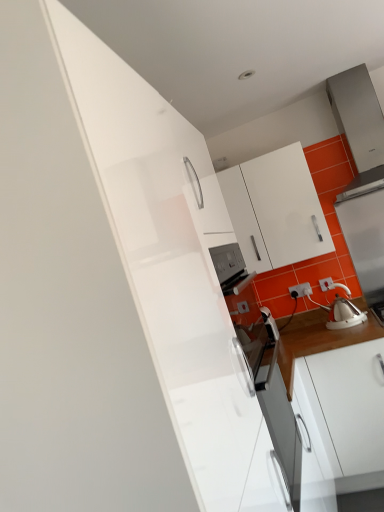
Question: Is white plastic electric outlet at lower right positioned behind white glossy kettle at right?

Choices:
 (A) no
 (B) yes

Answer: (B)

Question: From the image's perspective, is white plastic electric outlet at lower right over white glossy kettle at right?

Choices:
 (A) no
 (B) yes

Answer: (A)

Question: Is white plastic electric outlet at lower right positioned with its back to white glossy kettle at right?

Choices:
 (A) no
 (B) yes

Answer: (A)

Question: Is white plastic electric outlet at lower right smaller than white glossy kettle at right?

Choices:
 (A) yes
 (B) no

Answer: (A)

Question: Is white plastic electric outlet at lower right to the left of white glossy kettle at right from the viewer's perspective?

Choices:
 (A) yes
 (B) no

Answer: (A)

Question: Is white plastic electric outlet at lower right bigger than white glossy kettle at right?

Choices:
 (A) yes
 (B) no

Answer: (B)

Question: Is white plastic electric outlet at lower right completely or partially inside white glossy kettle at right?

Choices:
 (A) no
 (B) yes

Answer: (A)

Question: Is white glossy kettle at right further to camera compared to white plastic electric outlet at lower right?

Choices:
 (A) no
 (B) yes

Answer: (A)

Question: Can you confirm if white glossy kettle at right is bigger than white plastic electric outlet at lower right?

Choices:
 (A) yes
 (B) no

Answer: (A)

Question: From the image's perspective, is white glossy kettle at right below white plastic electric outlet at lower right?

Choices:
 (A) yes
 (B) no

Answer: (B)

Question: Is white glossy kettle at right smaller than white plastic electric outlet at lower right?

Choices:
 (A) yes
 (B) no

Answer: (B)

Question: Considering the relative sizes of white glossy kettle at right and white plastic electric outlet at lower right in the image provided, is white glossy kettle at right taller than white plastic electric outlet at lower right?

Choices:
 (A) yes
 (B) no

Answer: (A)

Question: Is the surface of white glossy kettle at right in direct contact with white glossy tea pot at right?

Choices:
 (A) yes
 (B) no

Answer: (B)